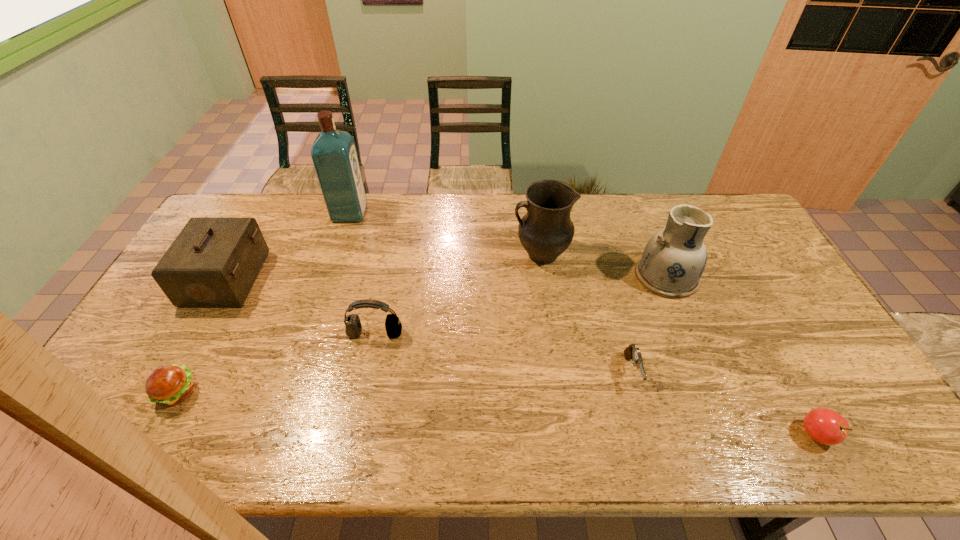
Find the location of `the rightmost object`. the rightmost object is located at coordinates (825, 426).

This screenshot has width=960, height=540. I want to click on free space located on the flat label side of the third object from left to right, so click(x=445, y=213).

The image size is (960, 540). Identify the location of vacant space situated on the back of the pottery. (634, 197).

The image size is (960, 540). In order to click on vacant space located 0.390m on the handle side of the fifth object from left to right in this screenshot , I will do `click(395, 254)`.

At what (x,y) coordinates should I click in order to perform the action: click on free space located 0.320m on the handle side of the fifth object from left to right. Please return your answer as a coordinate pair (x, y). Looking at the image, I should click on (416, 254).

Image resolution: width=960 pixels, height=540 pixels. Identify the location of vacant area situated on the handle side of the fifth object from left to right. (497, 254).

In order to click on vacant region located 0.300m on the right of the first-aid kit in this screenshot , I will do `click(356, 279)`.

This screenshot has height=540, width=960. In order to click on free space located on the headband of the fifth tallest object in this screenshot , I will do `click(370, 361)`.

Where is `free space located 0.130m at the barrel of the third object from right to left`? free space located 0.130m at the barrel of the third object from right to left is located at coordinates (652, 445).

In order to click on blank space located 0.100m on the right of the hamburger in this screenshot , I will do `click(238, 393)`.